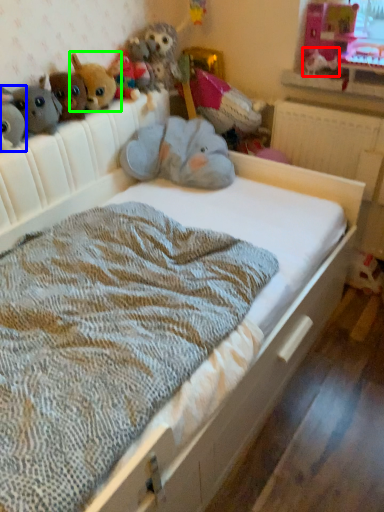
Question: Based on their relative distances, which object is farther from animal (highlighted by a red box)? Choose from toy (highlighted by a blue box) and toy (highlighted by a green box).

Choices:
 (A) toy
 (B) toy

Answer: (A)